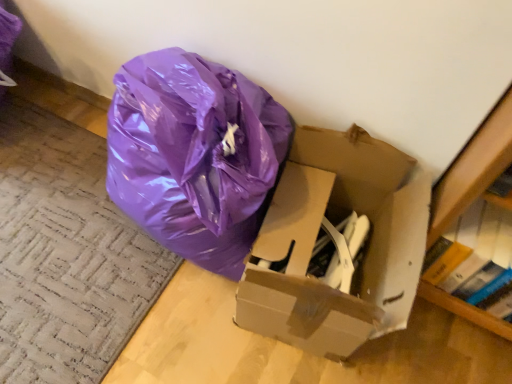
Image resolution: width=512 pixels, height=384 pixels. In order to click on vacant space to the left of cardboard box at center in this screenshot , I will do `click(173, 307)`.